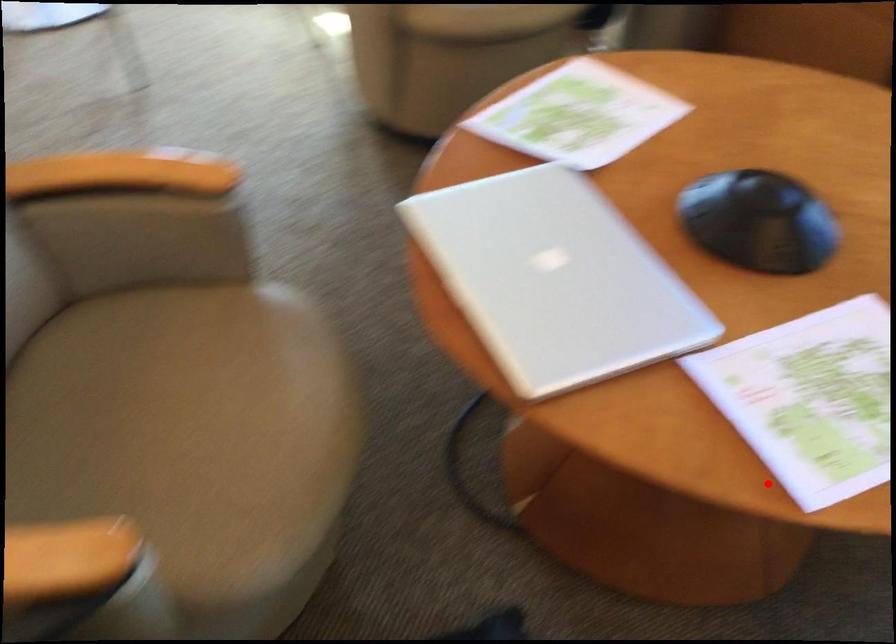
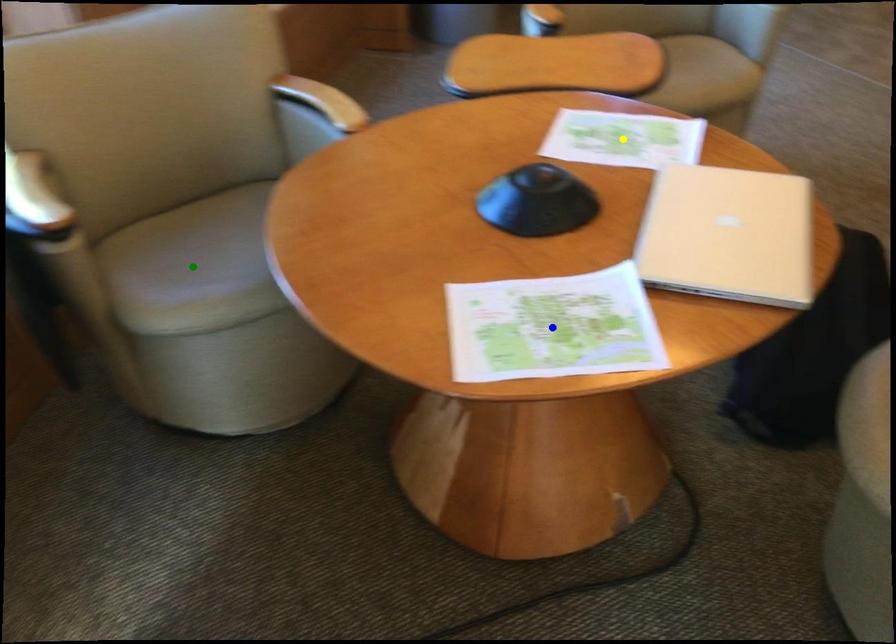
Question: I am providing you with two images of the same scene from different viewpoints. A red point is marked on the first image. You are given multiple points on the second image. Which point in image 2 represents the same 3d spot as the red point in image 1?

Choices:
 (A) yellow point
 (B) blue point
 (C) green point

Answer: (A)